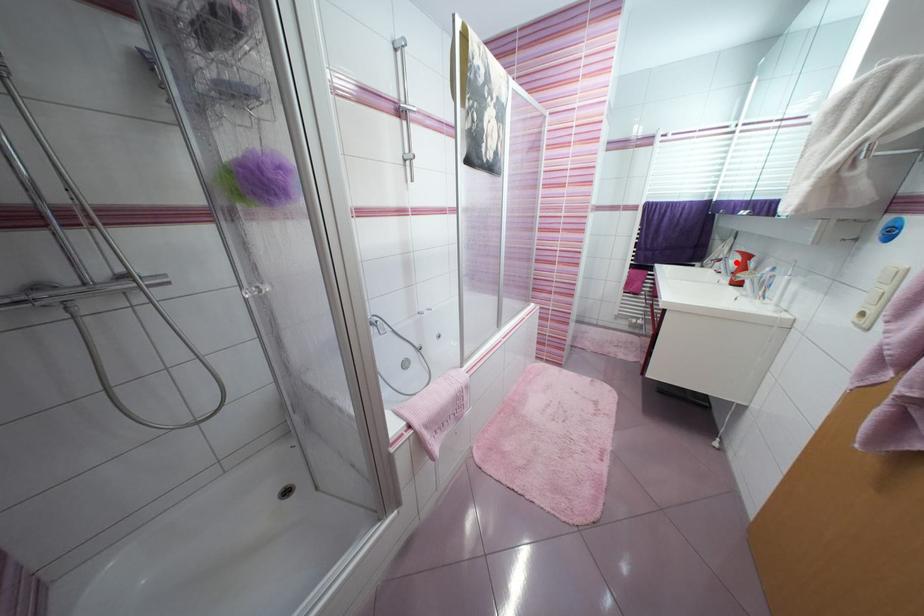
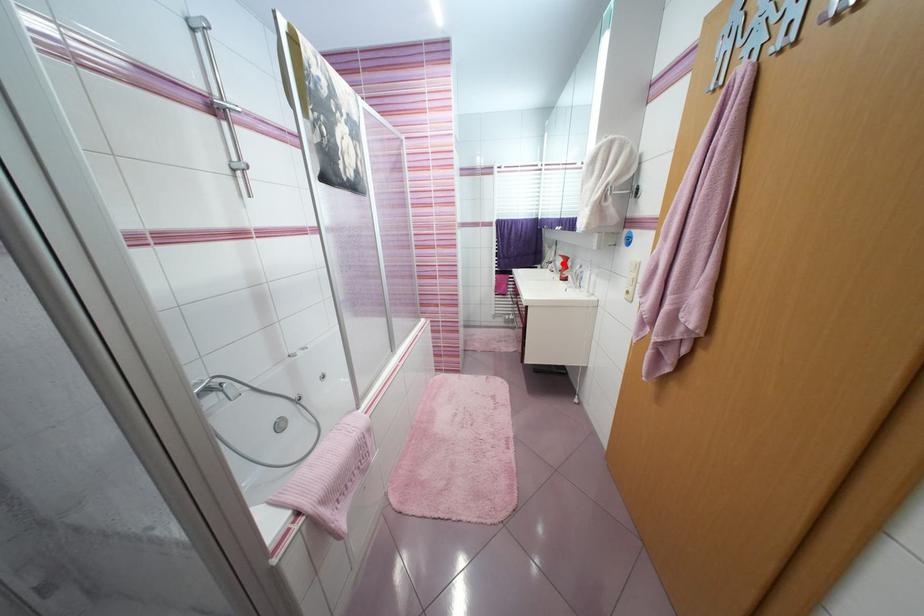
I am providing you with two images of the same scene from different viewpoints. A red point is marked on the first image and another point is marked on the second image. Do the highlighted points in image1 and image2 indicate the same real-world spot?

Yes